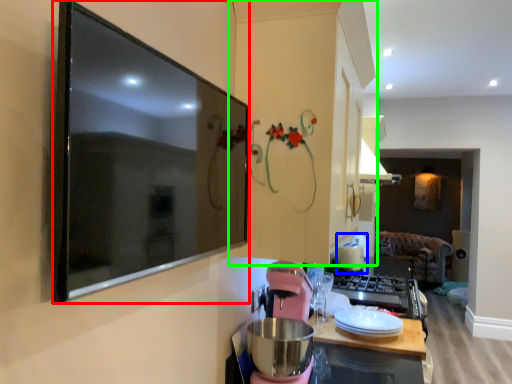
Question: Based on their relative distances, which object is nearer to picture frame (highlighted by a red box)? Choose from appliance (highlighted by a blue box) and cabinetry (highlighted by a green box).

Choices:
 (A) appliance
 (B) cabinetry

Answer: (B)